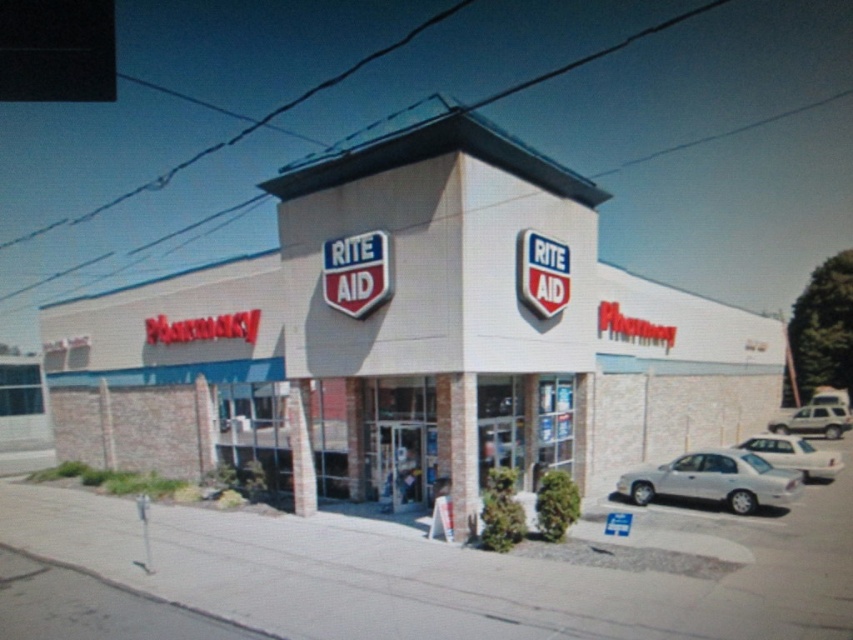
Is white brick building at center thinner than silver metallic sedan at lower right?

Incorrect, white brick building at center's width is not less than silver metallic sedan at lower right's.

From the picture: Which of these two, white brick building at center or silver metallic sedan at lower right, stands taller?

white brick building at center is taller.

Who is more forward, (503, 212) or (753, 467)?

Point (503, 212)

This screenshot has height=640, width=853. I want to click on white brick building at center, so click(438, 317).

Is white matte sedan at lower right positioned at the back of white matte suv at right?

No.

Who is higher up, white matte sedan at lower right or white matte suv at right?

white matte suv at right is higher up.

Between point (791, 440) and point (833, 428), which one is positioned in front?

Point (791, 440) is in front.

Where is `white matte sedan at lower right`? Image resolution: width=853 pixels, height=640 pixels. white matte sedan at lower right is located at coordinates (793, 456).

Describe the element at coordinates (715, 481) in the screenshot. The width and height of the screenshot is (853, 640). I see `silver metallic sedan at lower right` at that location.

Find the location of a particular element. This screenshot has height=640, width=853. silver metallic sedan at lower right is located at coordinates (715, 481).